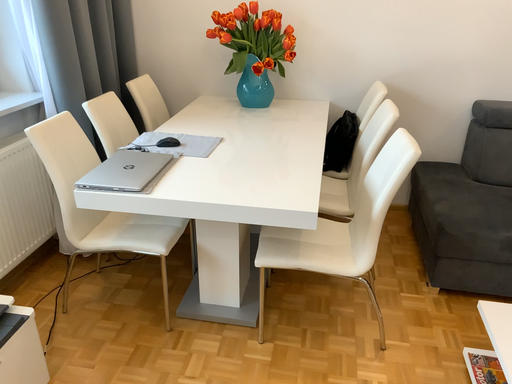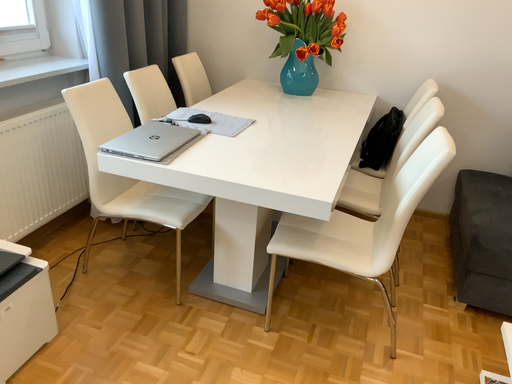
Question: Which way did the camera rotate in the video?

Choices:
 (A) rotated right
 (B) rotated left

Answer: (B)